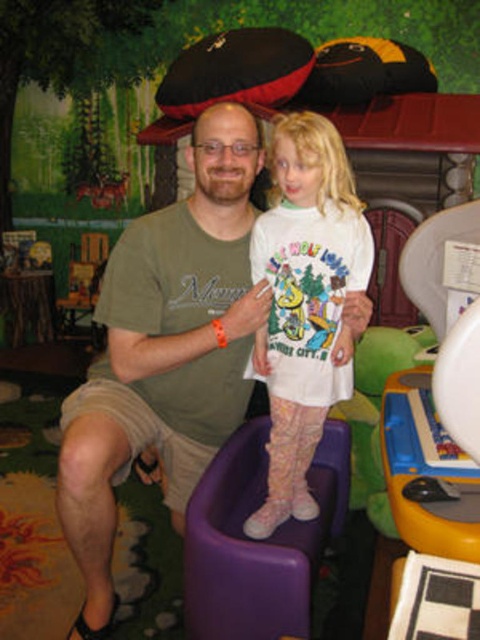
Question: Observing the image, what is the correct spatial positioning of green cotton shirt at center in reference to white matte t-shirt at center?

Choices:
 (A) right
 (B) left

Answer: (B)

Question: Among these objects, which one is farthest from the camera?

Choices:
 (A) green cotton shirt at center
 (B) white matte t-shirt at center

Answer: (A)

Question: Is green cotton shirt at center closer to camera compared to white matte t-shirt at center?

Choices:
 (A) yes
 (B) no

Answer: (B)

Question: Which of the following is the farthest from the observer?

Choices:
 (A) (129, 417)
 (B) (324, 408)

Answer: (A)

Question: Is green cotton shirt at center closer to camera compared to white matte t-shirt at center?

Choices:
 (A) no
 (B) yes

Answer: (A)